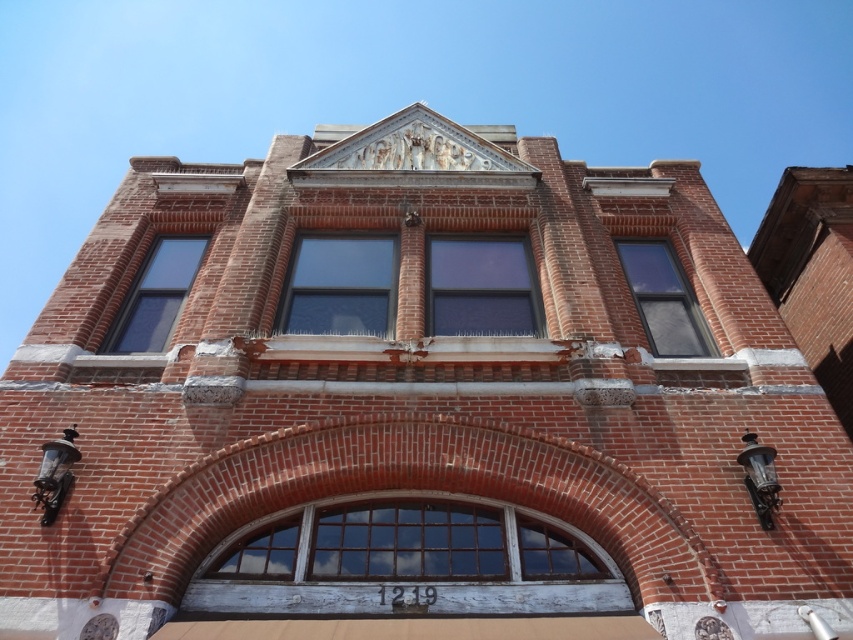
Question: Which point is farther to the camera?

Choices:
 (A) (289, 328)
 (B) (457, 304)
 (C) (166, 310)

Answer: (B)

Question: Which object is farther from the camera taking this photo?

Choices:
 (A) transparent glass window at center
 (B) clear glass window at right

Answer: (A)

Question: Which point appears farthest from the camera in this image?

Choices:
 (A) (643, 289)
 (B) (157, 339)
 (C) (289, 312)
 (D) (479, 301)

Answer: (A)

Question: Can you confirm if transparent glass window at center is bigger than matte glass window at upper left?

Choices:
 (A) yes
 (B) no

Answer: (A)

Question: From the image, what is the correct spatial relationship of clear glass window at center in relation to matte glass window at upper left?

Choices:
 (A) left
 (B) right

Answer: (B)

Question: Is clear glass window at right positioned before matte glass window at upper left?

Choices:
 (A) yes
 (B) no

Answer: (B)